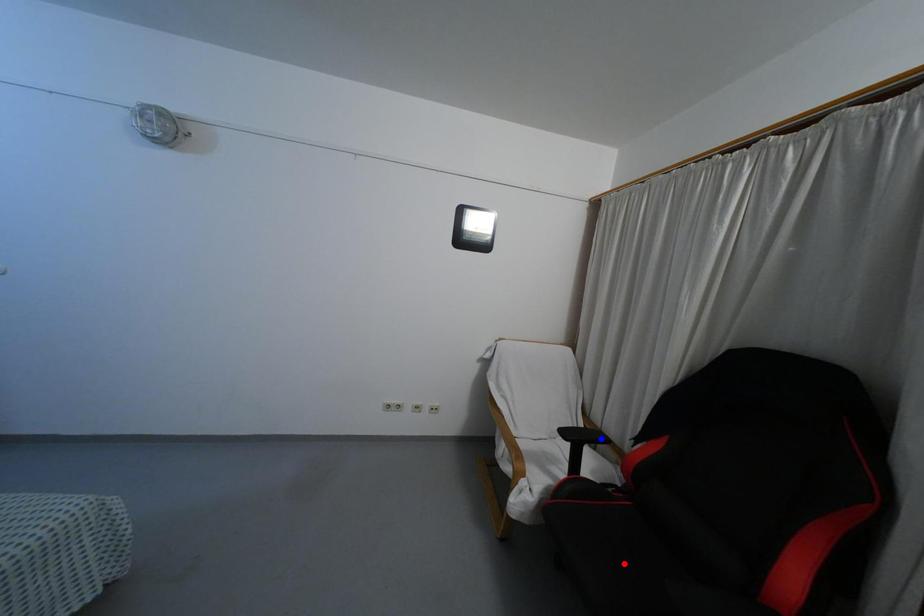
Question: Which of the two points in the image is closer to the camera?

Choices:
 (A) Blue point is closer.
 (B) Red point is closer.

Answer: (B)